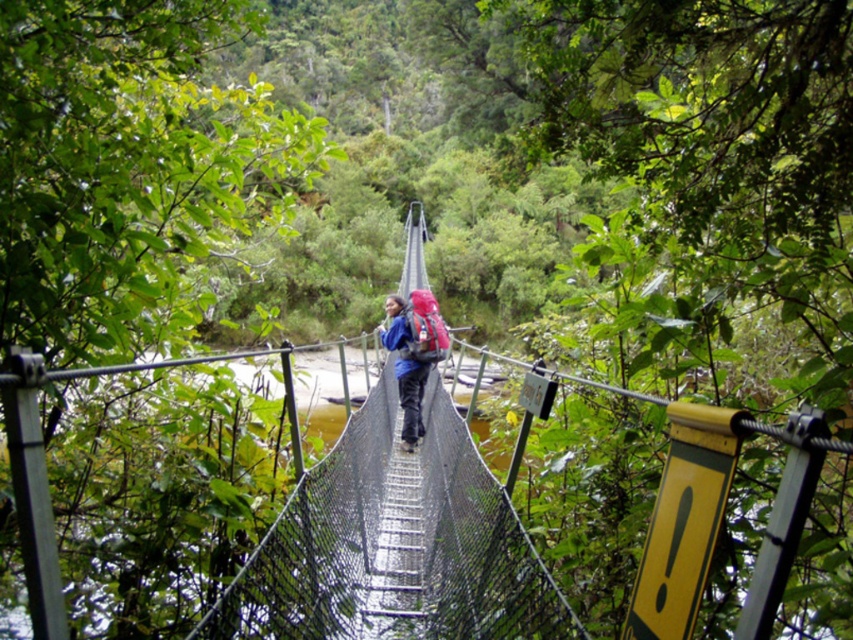
Who is positioned more to the left, metal mesh bridge at center or blue fabric backpack at center?

metal mesh bridge at center

Find the location of a particular element. metal mesh bridge at center is located at coordinates (316, 541).